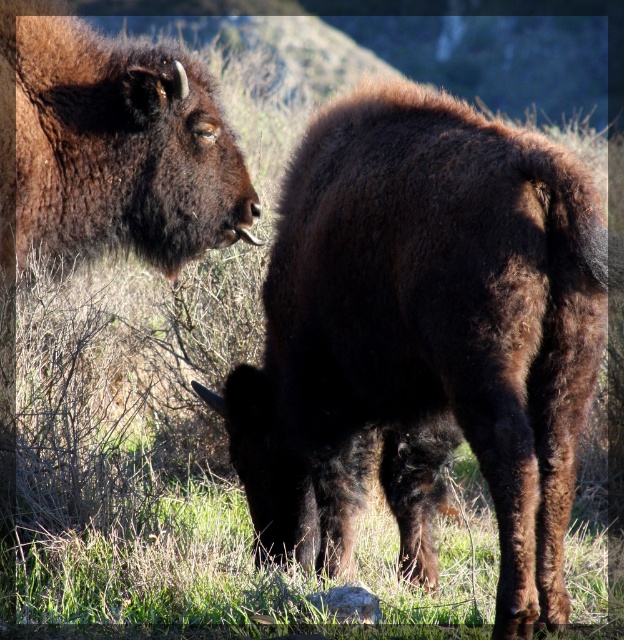
You are a wildlife photographer aiming to capture a closeup of the dark brown fur at center and the dark brown fur at upper left. Given that your camera can only focus on objects within a 2 meter range, can you take a photo of both subjects without moving your position?

The dark brown fur at center is closer to the viewer than the dark brown fur at upper left. Since the camera can focus within 2 meters, if the closer fur is within this range, the farther one might be beyond it. However, without knowing the exact distances, it depends on whether both are within the 2 meter range. The description only states their relative positions, not absolute distances.